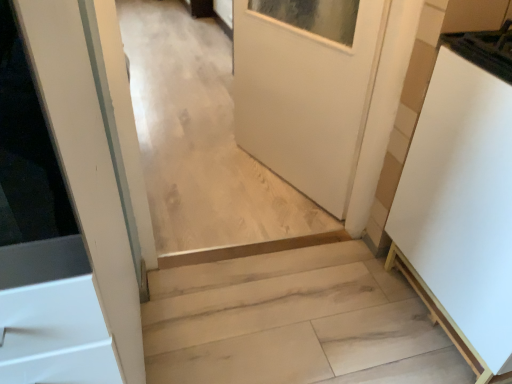
Question: Is light wood stairs at center further to the viewer compared to white matte cabinet at right?

Choices:
 (A) yes
 (B) no

Answer: (A)

Question: Can you confirm if light wood stairs at center is positioned to the left of white matte cabinet at right?

Choices:
 (A) yes
 (B) no

Answer: (A)

Question: Is light wood stairs at center in contact with white matte cabinet at right?

Choices:
 (A) no
 (B) yes

Answer: (A)

Question: From a real-world perspective, is light wood stairs at center on white matte cabinet at right?

Choices:
 (A) yes
 (B) no

Answer: (B)

Question: From a real-world perspective, is light wood stairs at center under white matte cabinet at right?

Choices:
 (A) no
 (B) yes

Answer: (B)

Question: Considering the relative sizes of light wood stairs at center and white matte cabinet at right in the image provided, is light wood stairs at center bigger than white matte cabinet at right?

Choices:
 (A) yes
 (B) no

Answer: (B)

Question: Is white matte cabinet at right aimed at light wood stairs at center?

Choices:
 (A) yes
 (B) no

Answer: (B)

Question: Is white matte cabinet at right at the right side of light wood stairs at center?

Choices:
 (A) yes
 (B) no

Answer: (A)

Question: Does white matte cabinet at right have a lesser height compared to light wood stairs at center?

Choices:
 (A) yes
 (B) no

Answer: (B)

Question: Can you confirm if white matte cabinet at right is thinner than light wood stairs at center?

Choices:
 (A) yes
 (B) no

Answer: (A)

Question: From a real-world perspective, does white matte cabinet at right stand above light wood stairs at center?

Choices:
 (A) no
 (B) yes

Answer: (B)

Question: From the image's perspective, is white matte cabinet at right under light wood stairs at center?

Choices:
 (A) no
 (B) yes

Answer: (A)

Question: From a real-world perspective, relative to light wood stairs at center, is white matte cabinet at right vertically above or below?

Choices:
 (A) below
 (B) above

Answer: (B)